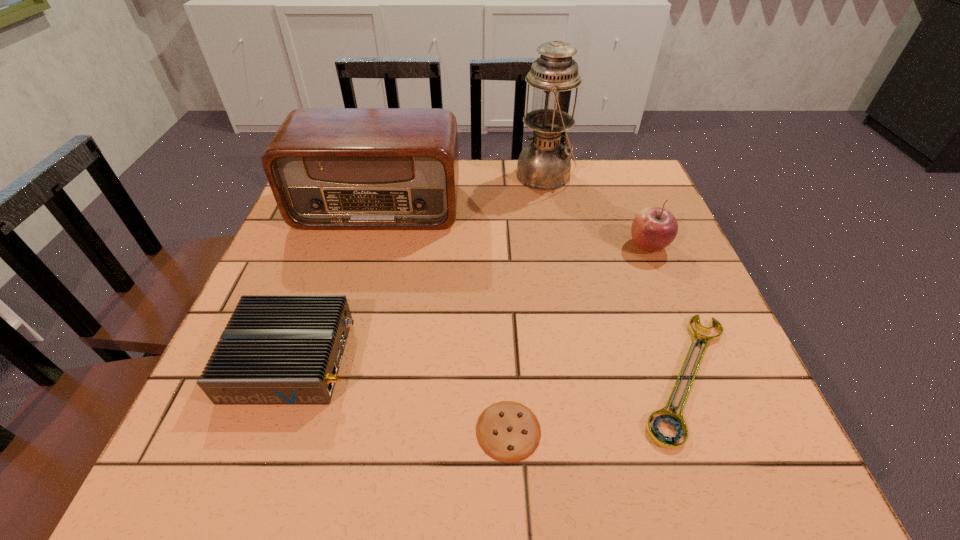
Locate an element on the screen. the tallest object is located at coordinates (544, 164).

The height and width of the screenshot is (540, 960). What are the coordinates of `the fourth object from left to right` in the screenshot? It's located at (544, 164).

Where is `the fifth shortest object`? The height and width of the screenshot is (540, 960). the fifth shortest object is located at coordinates (328, 168).

Locate an element on the screen. Image resolution: width=960 pixels, height=540 pixels. apple is located at coordinates (654, 228).

In order to click on the third farthest object in this screenshot , I will do `click(654, 228)`.

Where is `the fourth tallest object`? the fourth tallest object is located at coordinates (276, 349).

Identify the location of the fourth object from right to left. The height and width of the screenshot is (540, 960). (507, 431).

Find the location of a particular element. The width and height of the screenshot is (960, 540). wrench is located at coordinates (677, 421).

The height and width of the screenshot is (540, 960). I want to click on vacant area situated 0.200m on the right of the tallest object, so click(x=645, y=175).

You are a GUI agent. You are given a task and a screenshot of the screen. Output one action in this format:
    pyautogui.click(x=<x>, y=<y>)
    Task: Click on the free spot located 0.250m on the front panel of the fifth shortest object
    This screenshot has height=540, width=960.
    Given the screenshot: What is the action you would take?
    pyautogui.click(x=349, y=309)